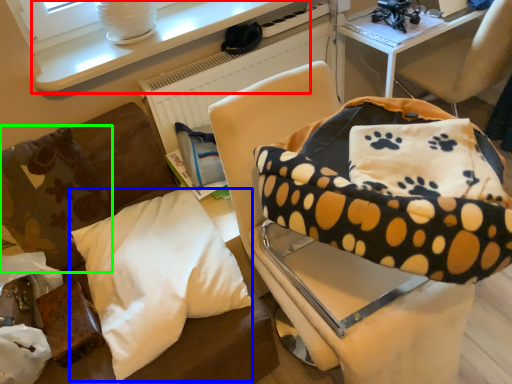
Question: Which object is positioned closest to table (highlighted by a red box)? Select from pillow (highlighted by a blue box) and pillow (highlighted by a green box).

Choices:
 (A) pillow
 (B) pillow

Answer: (B)